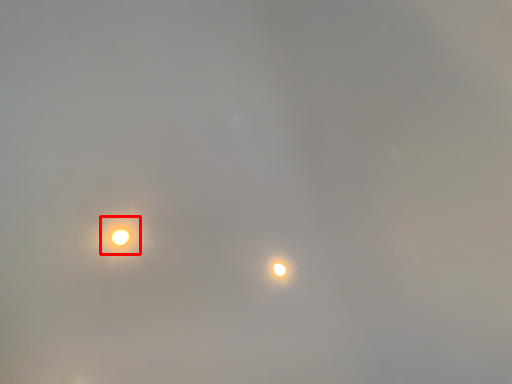
Question: Considering the relative positions of moonlight (annotated by the red box) and moonlight in the image provided, where is moonlight (annotated by the red box) located with respect to the staircase?

Choices:
 (A) left
 (B) right

Answer: (A)